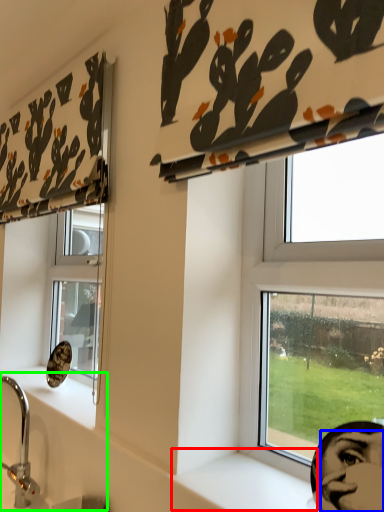
Question: Which object is the farthest from window sill (highlighted by a red box)? Choose among these: human face (highlighted by a blue box) or sink (highlighted by a green box).

Choices:
 (A) human face
 (B) sink

Answer: (B)